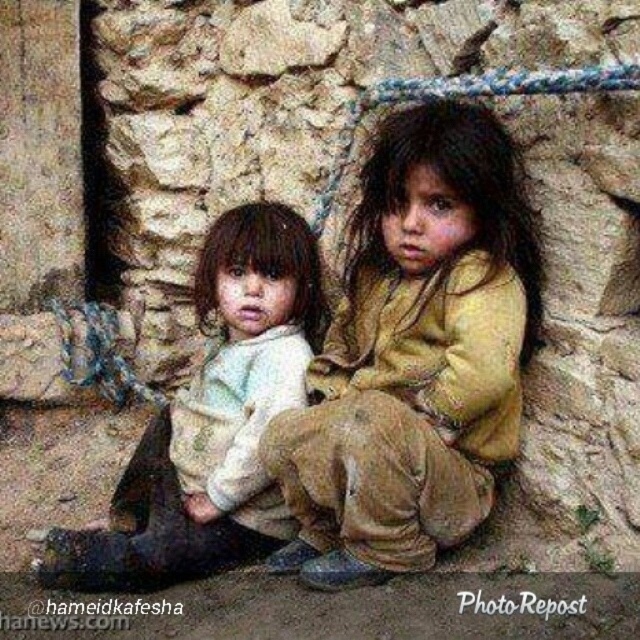
In the scene shown: You are a tailor who needs to determine which fabric can cover a wider area. Based on the image, which one between the brown textured cloth at center and the white soft fabric at center is wider?

The white soft fabric at center is wider than the brown textured cloth at center, so it can cover a wider area.

You are a tailor examining two fabrics in the center of the image. The brown textured cloth at center and the white soft fabric at center. Which one is taller?

The brown textured cloth at center is much taller than the white soft fabric at center.

You are a parent trying to comfort your children who are sitting against a stone wall. You have two fabrics available, the brown textured cloth at center and the white soft fabric at center. Which fabric should you place under the children to provide more comfort?

The white soft fabric at center should be placed under the children because it is located below the brown textured cloth at center, making it accessible and softer for comfort.